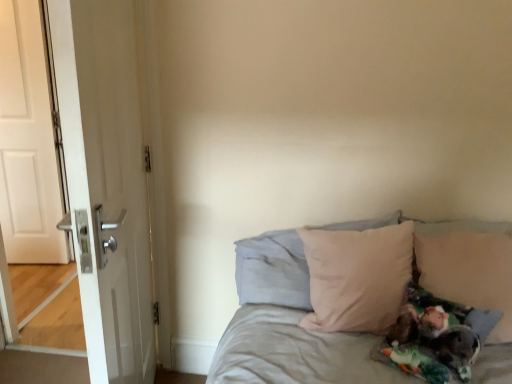
Question: Is white glossy door at left, which appears as the 2th door when viewed from the back, behind beige fabric pillow at center, arranged as the 2th pillow when viewed from the right?

Choices:
 (A) no
 (B) yes

Answer: (A)

Question: From the image's perspective, is white glossy door at left, the 1th door viewed from the right, beneath beige fabric pillow at center, the 1th pillow in the left-to-right sequence?

Choices:
 (A) no
 (B) yes

Answer: (A)

Question: Could you tell me if white glossy door at left, the 1th door viewed from the right, is turned towards beige fabric pillow at center, arranged as the 2th pillow when viewed from the right?

Choices:
 (A) yes
 (B) no

Answer: (A)

Question: Is white glossy door at left, the 1th door viewed from the front, wider than beige fabric pillow at center, the 1th pillow in the left-to-right sequence?

Choices:
 (A) no
 (B) yes

Answer: (A)

Question: Is white glossy door at left, the 1th door viewed from the front, to the left of beige fabric pillow at center, arranged as the 2th pillow when viewed from the right, from the viewer's perspective?

Choices:
 (A) yes
 (B) no

Answer: (A)

Question: In terms of width, does beige fabric pillow at right, arranged as the 1th pillow when viewed from the right, look wider or thinner when compared to beige fabric pillow at center, arranged as the 2th pillow when viewed from the right?

Choices:
 (A) wide
 (B) thin

Answer: (B)

Question: From a real-world perspective, is beige fabric pillow at right, arranged as the 1th pillow when viewed from the right, above or below beige fabric pillow at center, the 1th pillow in the left-to-right sequence?

Choices:
 (A) below
 (B) above

Answer: (B)

Question: Considering the relative positions of beige fabric pillow at right, arranged as the 1th pillow when viewed from the right, and beige fabric pillow at center, the 1th pillow in the left-to-right sequence, in the image provided, is beige fabric pillow at right, arranged as the 1th pillow when viewed from the right, to the left or to the right of beige fabric pillow at center, the 1th pillow in the left-to-right sequence,?

Choices:
 (A) left
 (B) right

Answer: (B)

Question: Considering the positions of point (475, 286) and point (259, 266), is point (475, 286) closer or farther from the camera than point (259, 266)?

Choices:
 (A) farther
 (B) closer

Answer: (B)

Question: Considering the positions of point (47, 167) and point (498, 377), is point (47, 167) closer or farther from the camera than point (498, 377)?

Choices:
 (A) farther
 (B) closer

Answer: (A)

Question: Based on their positions, is white matte door at left, the second door when ordered from front to back, located to the left or right of beige fabric bed at center?

Choices:
 (A) right
 (B) left

Answer: (B)

Question: From a real-world perspective, is white matte door at left, placed as the 1th door when sorted from left to right, physically located above or below beige fabric bed at center?

Choices:
 (A) below
 (B) above

Answer: (B)

Question: In terms of width, does white matte door at left, the first door positioned from the back, look wider or thinner when compared to beige fabric bed at center?

Choices:
 (A) thin
 (B) wide

Answer: (A)

Question: Is beige fabric pillow at center, arranged as the 2th pillow when viewed from the right, bigger or smaller than beige fabric pillow at right, arranged as the 1th pillow when viewed from the right?

Choices:
 (A) small
 (B) big

Answer: (B)

Question: Does point (289, 253) appear closer or farther from the camera than point (501, 288)?

Choices:
 (A) closer
 (B) farther

Answer: (B)